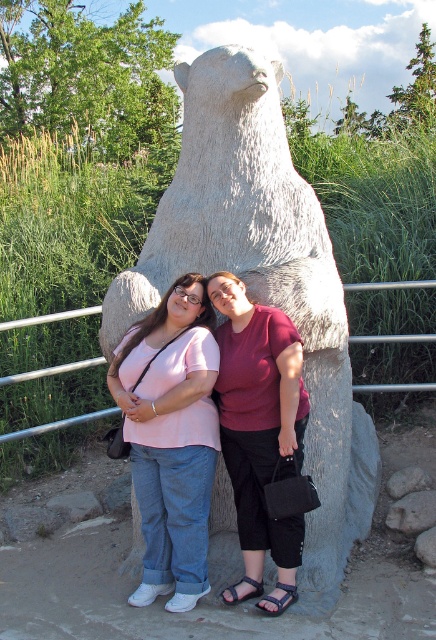
How distant is matte red shirt at center from metal/rail at upper center?

The distance of matte red shirt at center from metal/rail at upper center is 8.08 feet.

Does matte red shirt at center appear on the right side of metal/rail at upper center?

Indeed, matte red shirt at center is positioned on the right side of metal/rail at upper center.

Which is behind, point (237, 476) or point (91, 419)?

The point (91, 419) is more distant.

Identify the location of matte red shirt at center. (259, 433).

Does matte pink shirt at center have a larger size compared to metal/rail at upper center?

Indeed, matte pink shirt at center has a larger size compared to metal/rail at upper center.

Which is behind, point (126, 435) or point (41, 432)?

Positioned behind is point (41, 432).

Image resolution: width=436 pixels, height=640 pixels. Find the location of `matte pink shirt at center`. matte pink shirt at center is located at coordinates (170, 436).

Which is more to the right, white stone bear at center or matte pink shirt at center?

white stone bear at center

How far apart are white stone bear at center and matte pink shirt at center?

white stone bear at center is 27.74 inches from matte pink shirt at center.

Locate an element on the screen. This screenshot has width=436, height=640. white stone bear at center is located at coordinates [x=262, y=280].